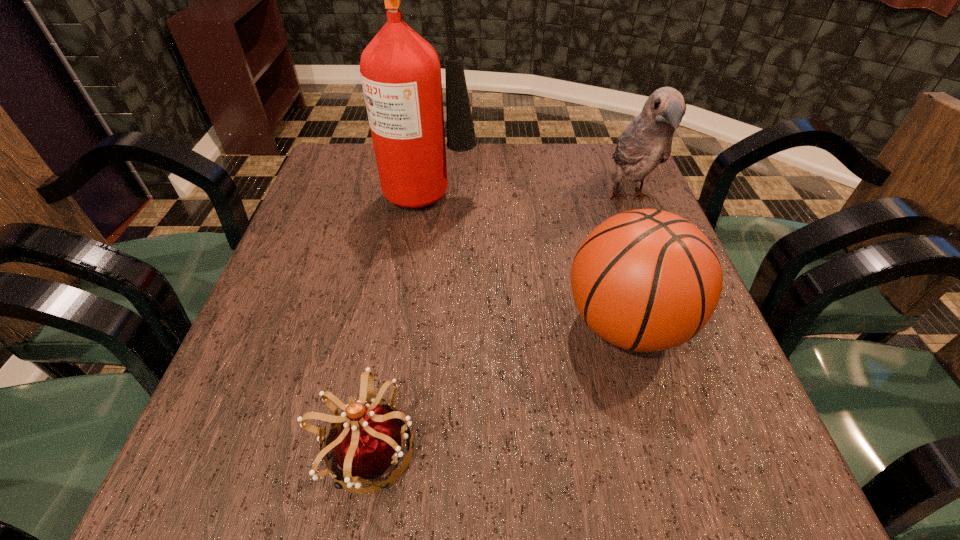
I want to click on vacant space at the far left corner of the desktop, so click(x=365, y=170).

You are a GUI agent. You are given a task and a screenshot of the screen. Output one action in this format:
    pyautogui.click(x=<x>, y=<y>)
    Task: Click on the vacant space at the far right corner of the desktop
    The height and width of the screenshot is (540, 960).
    Given the screenshot: What is the action you would take?
    pyautogui.click(x=603, y=190)

In order to click on blank region between the parrot and the shortest object in this screenshot , I will do coord(497,325).

Where is `free space between the tallest object and the parrot`? Image resolution: width=960 pixels, height=540 pixels. free space between the tallest object and the parrot is located at coordinates (530, 194).

At what (x,y) coordinates should I click in order to perform the action: click on vacant area between the nearest object and the parrot. Please return your answer as a coordinate pair (x, y). Image resolution: width=960 pixels, height=540 pixels. Looking at the image, I should click on (497, 325).

Find the location of a particular element. This screenshot has height=540, width=960. free space between the tiara and the basketball is located at coordinates (496, 388).

At what (x,y) coordinates should I click in order to perform the action: click on vacant area that lies between the tiara and the third tallest object. Please return your answer as a coordinate pair (x, y). The image size is (960, 540). Looking at the image, I should click on (496, 388).

The height and width of the screenshot is (540, 960). What are the coordinates of `blank region between the nearest object and the parrot` in the screenshot? It's located at (497, 325).

Locate an element on the screen. This screenshot has height=540, width=960. free spot between the fire extinguisher and the second nearest object is located at coordinates (529, 258).

Locate an element on the screen. This screenshot has width=960, height=540. free space between the tallest object and the third shortest object is located at coordinates (530, 194).